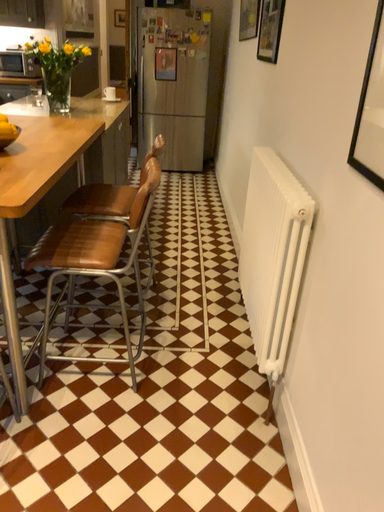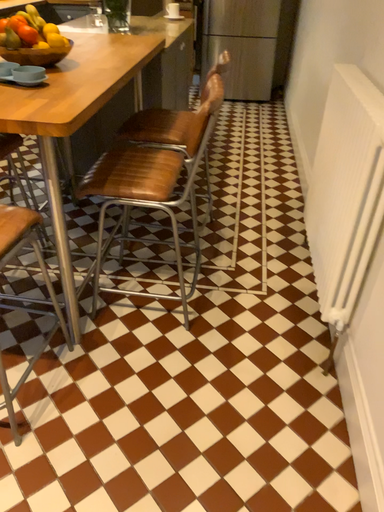
Question: Which way did the camera rotate in the video?

Choices:
 (A) rotated downward
 (B) rotated upward

Answer: (A)